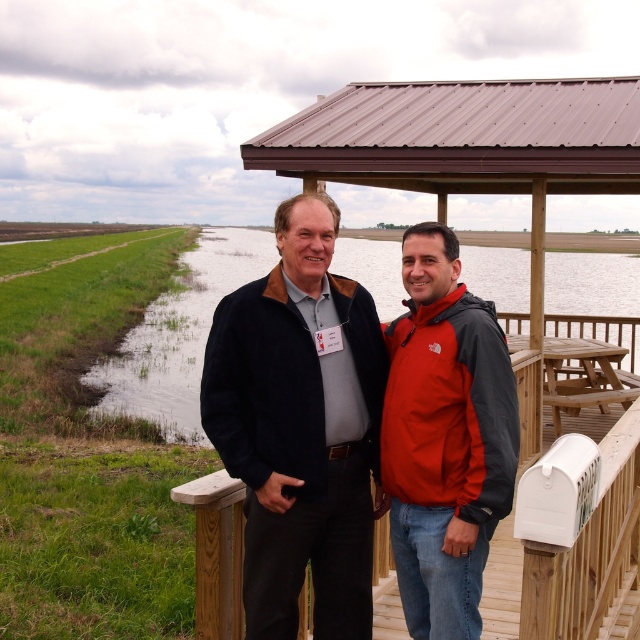
Looking at this image, you are a delivery person trying to place a package on the wooden deck. The package is 1.2 meters in length. Can the matte red jacket at center and the wooden at center be moved to make space?

The matte red jacket at center is smaller than wooden at center. Since the wooden at center is larger, moving both might require more space. However, the total space needed depends on their combined size. Without knowing the exact dimensions of the wooden at center, it is uncertain if moving them would provide enough space for the 1.2 meter package.

You are designing a garden layout and need to know which area is wider between the green grass at lower left and the wooden at center. Which one is wider?

The green grass at lower left is wider than the wooden at center because its width surpasses that of the wooden at center.

You are a delivery person trying to find the correct mailbox. You see the green grass at lower left and the wooden at center. Which direction should you walk to reach the mailbox?

Since the green grass at lower left is to the right of wooden at center, the mailbox is on the right side of the frame. Therefore, you should walk towards the right side of the frame to reach the mailbox.